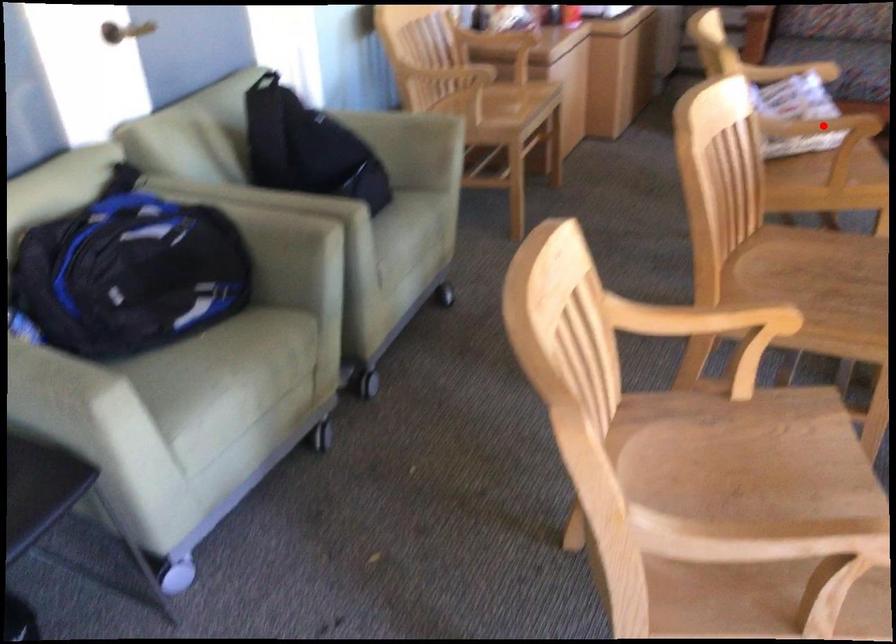
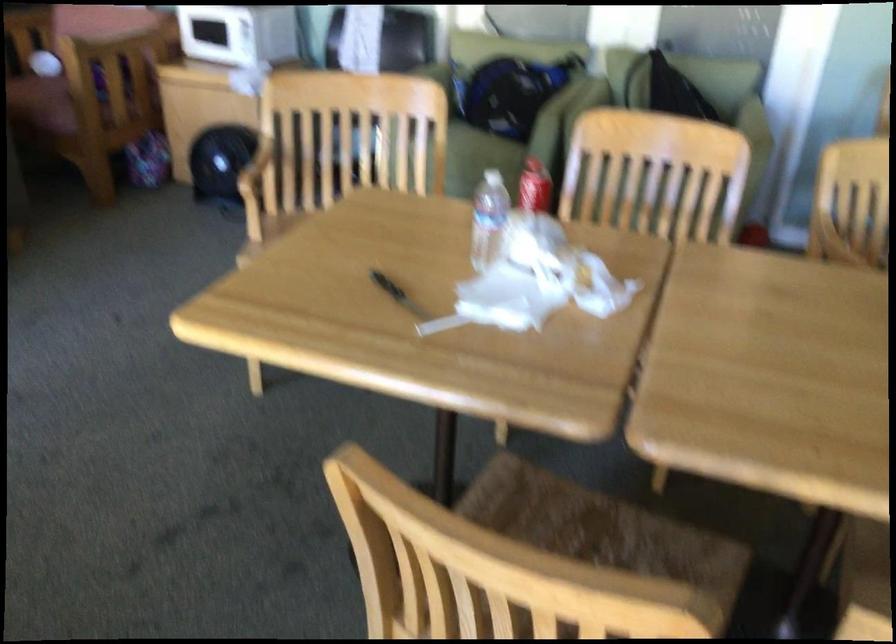
Question: I am providing you with two images of the same scene from different viewpoints. A red point is marked on the first image. Can you still see the location of the red point in image 2?

Choices:
 (A) Yes
 (B) No

Answer: (B)